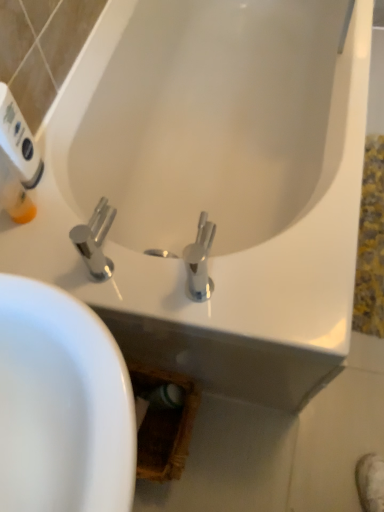
Question: Is polished chrome faucet at center wider or thinner than white plastic hand dryer at upper left?

Choices:
 (A) thin
 (B) wide

Answer: (B)

Question: In terms of height, does polished chrome faucet at center look taller or shorter compared to white plastic hand dryer at upper left?

Choices:
 (A) short
 (B) tall

Answer: (A)

Question: From a real-world perspective, relative to white plastic hand dryer at upper left, is polished chrome faucet at center vertically above or below?

Choices:
 (A) below
 (B) above

Answer: (A)

Question: In the image, is white plastic hand dryer at upper left positioned in front of or behind polished chrome faucet at center?

Choices:
 (A) front
 (B) behind

Answer: (B)

Question: Considering the positions of point (34, 142) and point (110, 209), is point (34, 142) closer or farther from the camera than point (110, 209)?

Choices:
 (A) closer
 (B) farther

Answer: (B)

Question: Is white plastic hand dryer at upper left wider or thinner than polished chrome faucet at center?

Choices:
 (A) thin
 (B) wide

Answer: (A)

Question: Based on their sizes in the image, would you say white plastic hand dryer at upper left is bigger or smaller than polished chrome faucet at center?

Choices:
 (A) small
 (B) big

Answer: (A)